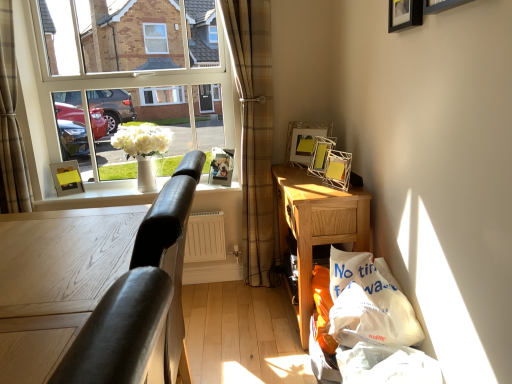
Question: Is metallic silver photo frame at center, placed as the 2th picture frame when sorted from left to right, oriented towards white plastic bag at lower right?

Choices:
 (A) no
 (B) yes

Answer: (A)

Question: Does metallic silver photo frame at center, which is the fifth picture frame from right to left, have a smaller size compared to white plastic bag at lower right?

Choices:
 (A) no
 (B) yes

Answer: (B)

Question: Is metallic silver photo frame at center, which is the fifth picture frame from right to left, not inside white plastic bag at lower right?

Choices:
 (A) no
 (B) yes

Answer: (B)

Question: Considering the relative sizes of metallic silver photo frame at center, placed as the 2th picture frame when sorted from left to right, and white plastic bag at lower right in the image provided, is metallic silver photo frame at center, placed as the 2th picture frame when sorted from left to right, shorter than white plastic bag at lower right?

Choices:
 (A) no
 (B) yes

Answer: (B)

Question: From a real-world perspective, is metallic silver photo frame at center, placed as the 2th picture frame when sorted from left to right, positioned over white plastic bag at lower right based on gravity?

Choices:
 (A) yes
 (B) no

Answer: (A)

Question: Considering the relative positions of metallic silver photo frame at center, which is the fifth picture frame from right to left, and white plastic bag at lower right in the image provided, is metallic silver photo frame at center, which is the fifth picture frame from right to left, to the left of white plastic bag at lower right from the viewer's perspective?

Choices:
 (A) yes
 (B) no

Answer: (A)

Question: From the image's perspective, is plaid fabric curtain at left, the 1th curtain in the left-to-right sequence, located above matte yellow picture frame at left, which appears as the 6th picture frame when viewed from the right?

Choices:
 (A) yes
 (B) no

Answer: (A)

Question: Is plaid fabric curtain at left, the 2th curtain viewed from the right, far from matte yellow picture frame at left, which appears as the 6th picture frame when viewed from the right?

Choices:
 (A) yes
 (B) no

Answer: (B)

Question: Can you confirm if plaid fabric curtain at left, the 2th curtain viewed from the right, is wider than matte yellow picture frame at left, positioned as the second picture frame in back-to-front order?

Choices:
 (A) no
 (B) yes

Answer: (B)

Question: From a real-world perspective, is plaid fabric curtain at left, the 1th curtain in the left-to-right sequence, located beneath matte yellow picture frame at left, the first picture frame when ordered from left to right?

Choices:
 (A) yes
 (B) no

Answer: (B)

Question: From the image's perspective, is plaid fabric curtain at left, the 1th curtain in the left-to-right sequence, located beneath matte yellow picture frame at left, the first picture frame when ordered from left to right?

Choices:
 (A) no
 (B) yes

Answer: (A)

Question: Does plaid fabric curtain at left, the 1th curtain in the left-to-right sequence, have a greater height compared to matte yellow picture frame at left, the first picture frame when ordered from left to right?

Choices:
 (A) yes
 (B) no

Answer: (A)

Question: Is brown plaid curtain at left, which appears as the first curtain when viewed from the right, far from matte yellow picture frame at left, arranged as the fifth picture frame when viewed from the front?

Choices:
 (A) no
 (B) yes

Answer: (B)